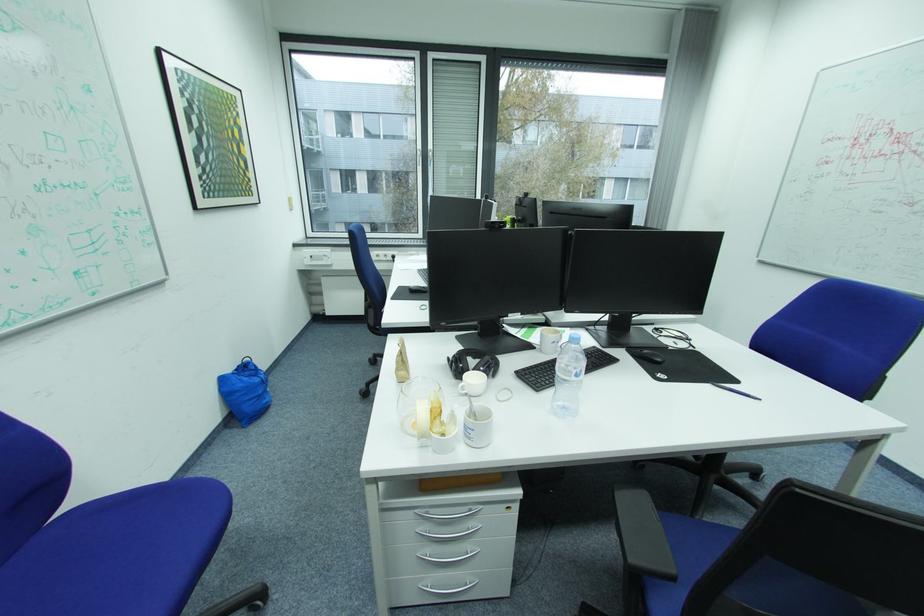
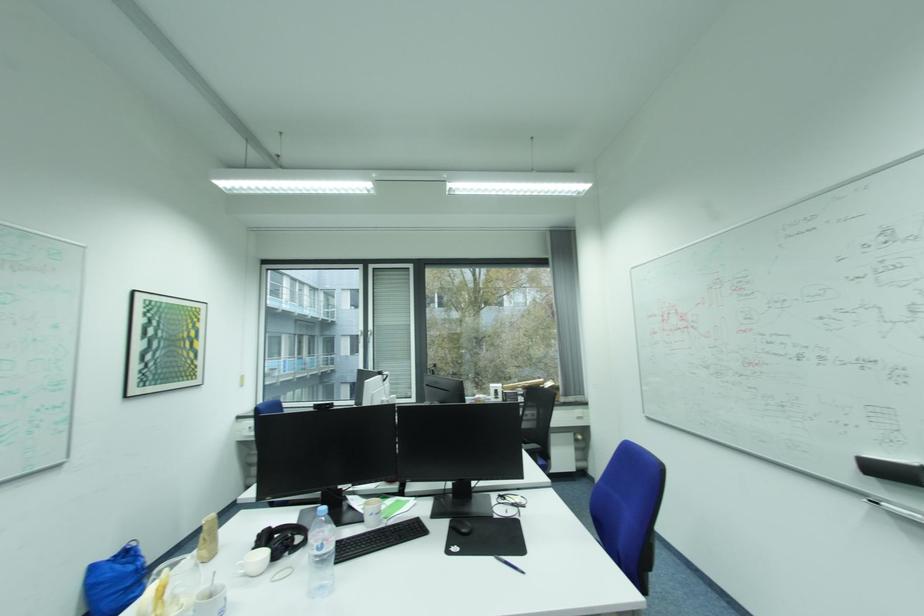
Where in the second image is the point corresponding to [582,375] from the first image?

(323, 549)